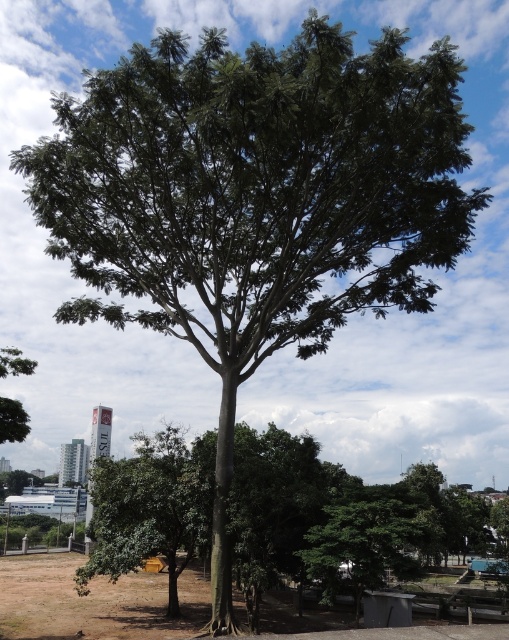
Based on the photo, you are standing in a park and want to take a closer look at the green leafy tree at lower center and the green leafy tree at left. Which tree should you walk towards first if you want to reach the one that is closer to you?

You should first walk towards the green leafy tree at left because it is closer to you than the green leafy tree at lower center, which is further away.

You are standing at the point marked by the coordinate point at (371, 538) in the image. What object are you facing directly?

You are facing the green leafy tree at lower center marked by the point at (371, 538).